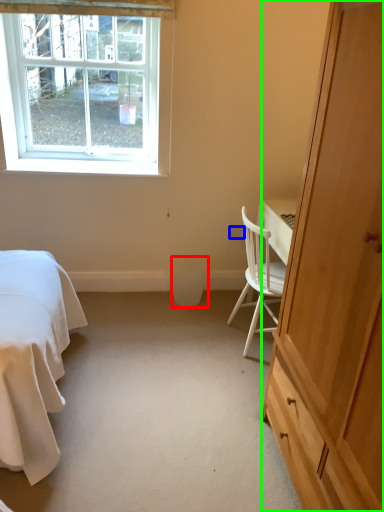
Question: Which object is the farthest from trash bin/can (highlighted by a red box)? Choose among these: power outlet (highlighted by a blue box) or cabinetry (highlighted by a green box).

Choices:
 (A) power outlet
 (B) cabinetry

Answer: (B)